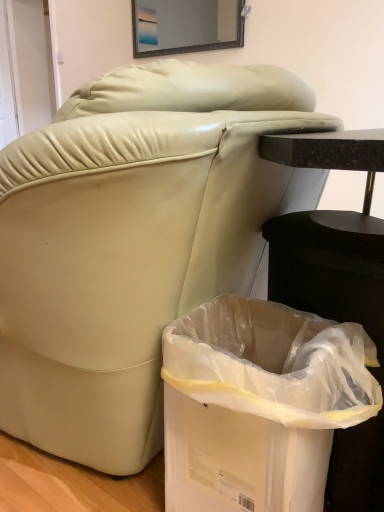
Where is `matte glass mirror at upper center`? This screenshot has width=384, height=512. matte glass mirror at upper center is located at coordinates (185, 26).

The width and height of the screenshot is (384, 512). What do you see at coordinates (185, 26) in the screenshot?
I see `matte glass mirror at upper center` at bounding box center [185, 26].

Locate an element on the screen. This screenshot has width=384, height=512. white plastic trash bin at lower right is located at coordinates (259, 404).

What do you see at coordinates (259, 404) in the screenshot?
I see `white plastic trash bin at lower right` at bounding box center [259, 404].

This screenshot has width=384, height=512. What are the coordinates of `matte glass mirror at upper center` in the screenshot? It's located at (185, 26).

Considering the relative positions of white plastic trash bin at lower right and matte glass mirror at upper center in the image provided, is white plastic trash bin at lower right to the left or to the right of matte glass mirror at upper center?

In the image, white plastic trash bin at lower right appears on the right side of matte glass mirror at upper center.

Is white plastic trash bin at lower right positioned in front of matte glass mirror at upper center?

Yes, it is in front of matte glass mirror at upper center.

Considering the positions of points (261, 458) and (210, 46), is point (261, 458) farther from camera compared to point (210, 46)?

That is False.

From the image's perspective, is white plastic trash bin at lower right on top of matte glass mirror at upper center?

No, from the image's perspective, white plastic trash bin at lower right is not on top of matte glass mirror at upper center.

From a real-world perspective, is white plastic trash bin at lower right on top of matte glass mirror at upper center?

No, from a real-world perspective, white plastic trash bin at lower right is not on top of matte glass mirror at upper center.

Considering the relative sizes of white plastic trash bin at lower right and matte glass mirror at upper center in the image provided, is white plastic trash bin at lower right wider than matte glass mirror at upper center?

Yes, white plastic trash bin at lower right is wider than matte glass mirror at upper center.

Considering the sizes of objects white plastic trash bin at lower right and matte glass mirror at upper center in the image provided, who is taller, white plastic trash bin at lower right or matte glass mirror at upper center?

Standing taller between the two is white plastic trash bin at lower right.

Which of these two, white plastic trash bin at lower right or matte glass mirror at upper center, is bigger?

white plastic trash bin at lower right is bigger.

Is matte glass mirror at upper center located within white plastic trash bin at lower right?

No, matte glass mirror at upper center is located outside of white plastic trash bin at lower right.

Is white plastic trash bin at lower right far from matte glass mirror at upper center?

Indeed, white plastic trash bin at lower right is not near matte glass mirror at upper center.

Could you tell me if white plastic trash bin at lower right is facing matte glass mirror at upper center?

No, white plastic trash bin at lower right is not facing towards matte glass mirror at upper center.

How many degrees apart are the facing directions of white plastic trash bin at lower right and matte glass mirror at upper center?

They differ by 89.9 degrees in their facing directions.

Locate an element on the screen. trash bin/can that is on the right side of matte glass mirror at upper center is located at coordinates click(x=259, y=404).

Does matte glass mirror at upper center appear on the right side of white plastic trash bin at lower right?

In fact, matte glass mirror at upper center is to the left of white plastic trash bin at lower right.

Which object is more forward, matte glass mirror at upper center or white plastic trash bin at lower right?

white plastic trash bin at lower right is closer to the camera.

Considering the points (154, 17) and (249, 454), which point is behind, point (154, 17) or point (249, 454)?

The point (154, 17) is more distant.

From the image's perspective, is matte glass mirror at upper center located beneath white plastic trash bin at lower right?

Incorrect, from the image's perspective, matte glass mirror at upper center is higher than white plastic trash bin at lower right.

From a real-world perspective, is matte glass mirror at upper center beneath white plastic trash bin at lower right?

Actually, matte glass mirror at upper center is physically above white plastic trash bin at lower right in the real world.

Considering the sizes of matte glass mirror at upper center and white plastic trash bin at lower right in the image, is matte glass mirror at upper center wider or thinner than white plastic trash bin at lower right?

In the image, matte glass mirror at upper center appears to be more narrow than white plastic trash bin at lower right.

Between matte glass mirror at upper center and white plastic trash bin at lower right, which one has less height?

With less height is matte glass mirror at upper center.

Is matte glass mirror at upper center bigger or smaller than white plastic trash bin at lower right?

Considering their sizes, matte glass mirror at upper center takes up less space than white plastic trash bin at lower right.

Is matte glass mirror at upper center inside or outside of white plastic trash bin at lower right?

matte glass mirror at upper center exists outside the volume of white plastic trash bin at lower right.

Is matte glass mirror at upper center far away from white plastic trash bin at lower right?

Absolutely, matte glass mirror at upper center is distant from white plastic trash bin at lower right.

Is matte glass mirror at upper center oriented towards white plastic trash bin at lower right?

No, matte glass mirror at upper center is not facing towards white plastic trash bin at lower right.

This screenshot has width=384, height=512. I want to click on trash bin/can that is below the matte glass mirror at upper center (from the image's perspective), so click(x=259, y=404).

The width and height of the screenshot is (384, 512). What are the coordinates of `mirror above the white plastic trash bin at lower right (from the image's perspective)` in the screenshot? It's located at (185, 26).

Locate an element on the screen. trash bin/can that appears below the matte glass mirror at upper center (from a real-world perspective) is located at coordinates (259, 404).